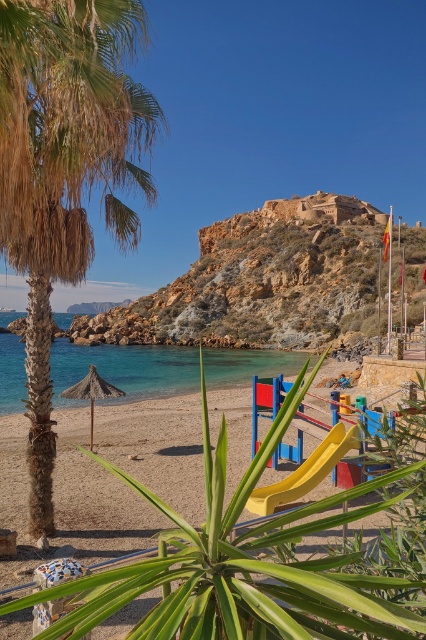
You are standing at the center of the beach scene. Which direction should you walk to reach the green leafy palm tree at left?

The green leafy palm tree at left is located at point 0.267 on the x and 0.153 on the y coordinates, so you should walk towards the left side of the scene to reach it.

You are a parent trying to decide where to place your child for a safe play area. The yellow plastic slide at center is smaller than the natural straw umbrella at center. Which object is closer to the water?

The yellow plastic slide at center is closer to the water than the natural straw umbrella at center because it is smaller and positioned at the center, while the umbrella is likely placed further back for shade.

You are standing on the beach and want to reach the clear blue water at center. Which direction should you walk to get there?

You should walk towards the center of the beach to reach the clear blue water at center, as it is located at point coordinates approximately 0.577 on the x axis and 0.296 on the y axis.